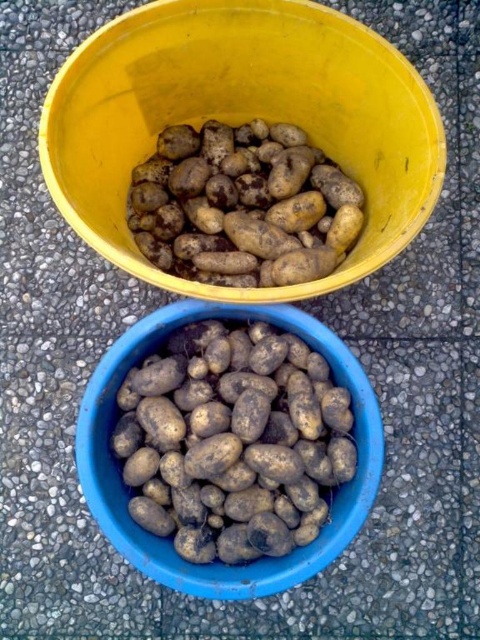
Question: Which point is farther to the camera?

Choices:
 (A) (282, 10)
 (B) (172, 209)

Answer: (B)

Question: Estimate the real-world distances between objects in this image. Which object is closer to the smooth brown potato at bottom center?

Choices:
 (A) brown matte potatoes at upper center
 (B) yellow plastic bucket at upper center

Answer: (A)

Question: Is yellow plastic bucket at upper center smaller than brown matte potatoes at upper center?

Choices:
 (A) yes
 (B) no

Answer: (B)

Question: Is yellow plastic bucket at upper center further to the viewer compared to smooth brown potato at bottom center?

Choices:
 (A) no
 (B) yes

Answer: (A)

Question: Can you confirm if smooth brown potato at bottom center is bigger than brown matte potatoes at upper center?

Choices:
 (A) yes
 (B) no

Answer: (B)

Question: Which point is closer to the camera?

Choices:
 (A) (260, 108)
 (B) (228, 282)
 (C) (295, 518)

Answer: (C)